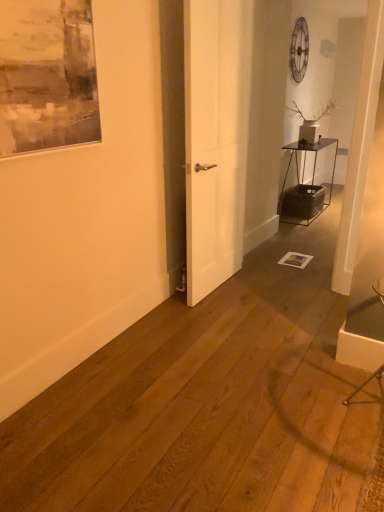
The width and height of the screenshot is (384, 512). I want to click on free space between metallic silver armchair at lower right and white matte door at center, so click(273, 324).